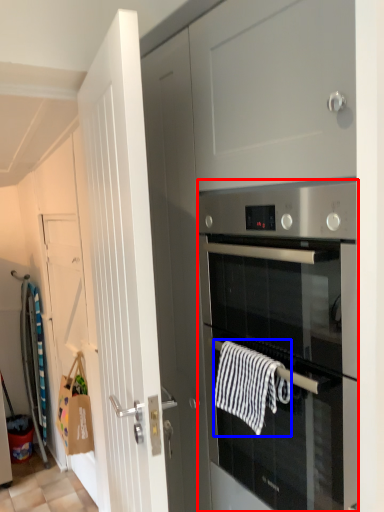
Question: Which of the following is the farthest to the observer, oven (highlighted by a red box) or hand towel (highlighted by a blue box)?

Choices:
 (A) oven
 (B) hand towel

Answer: (B)